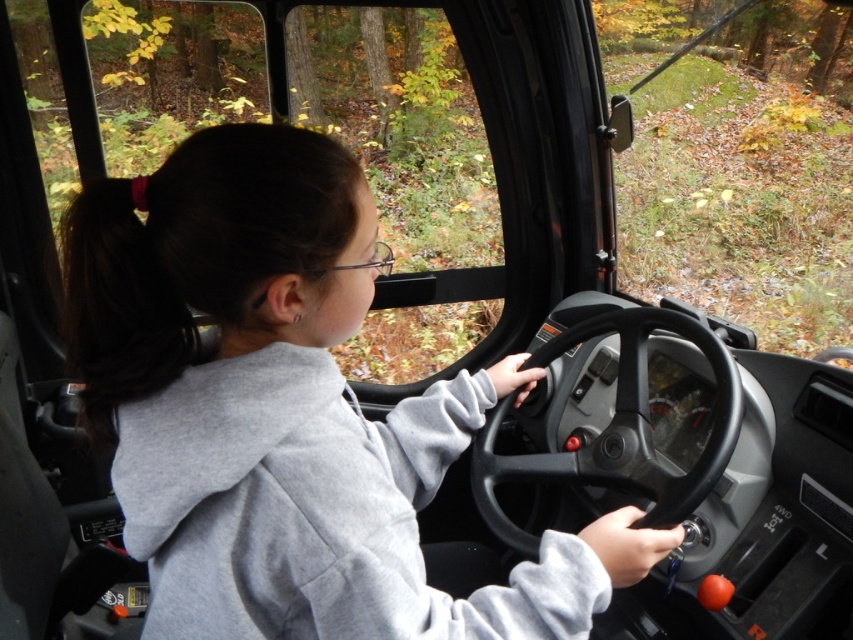
Does dark brown hair at left lie behind black rubber steering wheel at center?

No.

Can you confirm if dark brown hair at left is taller than black rubber steering wheel at center?

Incorrect, dark brown hair at left's height is not larger of black rubber steering wheel at center's.

The width and height of the screenshot is (853, 640). Identify the location of dark brown hair at left. (132, 288).